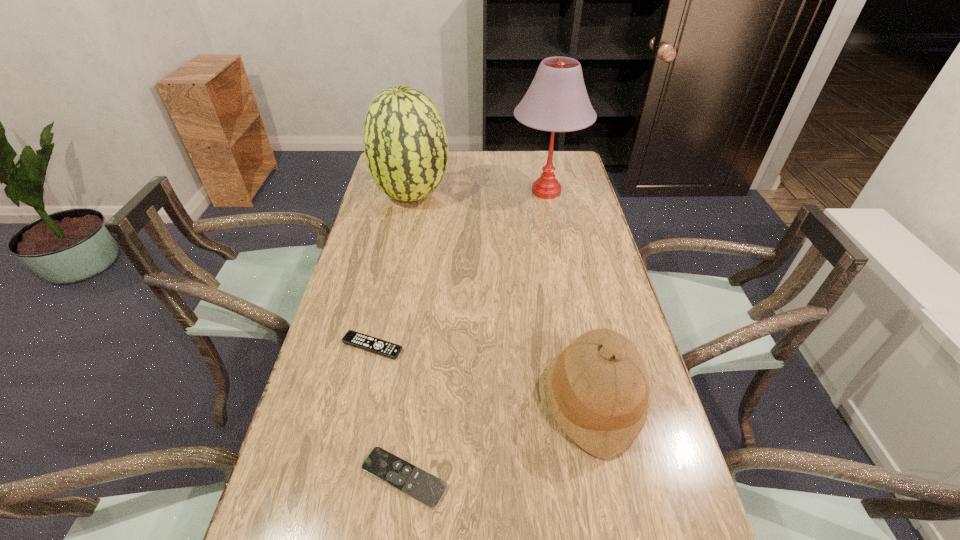
Where is `free space located 0.370m on the front-facing side of the third shortest object`? free space located 0.370m on the front-facing side of the third shortest object is located at coordinates (385, 400).

Locate an element on the screen. The image size is (960, 540). free space located on the front-facing side of the third shortest object is located at coordinates (441, 400).

Where is `free space located on the back of the farther remote control`? The width and height of the screenshot is (960, 540). free space located on the back of the farther remote control is located at coordinates (381, 308).

Locate an element on the screen. The image size is (960, 540). vacant space located 0.070m on the left of the nearer remote control is located at coordinates (326, 477).

In order to click on table lamp located in the far edge section of the desktop in this screenshot , I will do `click(557, 101)`.

Find the location of `watermelon present at the far edge`. watermelon present at the far edge is located at coordinates point(405,143).

Find the location of a particular element. The width and height of the screenshot is (960, 540). watermelon at the left edge is located at coordinates (405, 143).

You are a GUI agent. You are given a task and a screenshot of the screen. Output one action in this format:
    pyautogui.click(x=<x>, y=<y>)
    Task: Click on the table lamp that is positioned at the right edge
    The width and height of the screenshot is (960, 540).
    Given the screenshot: What is the action you would take?
    pyautogui.click(x=557, y=101)

Where is `hat that is positioned at the right edge`? The height and width of the screenshot is (540, 960). hat that is positioned at the right edge is located at coordinates (597, 388).

Image resolution: width=960 pixels, height=540 pixels. I want to click on object that is positioned at the far left corner, so click(x=405, y=143).